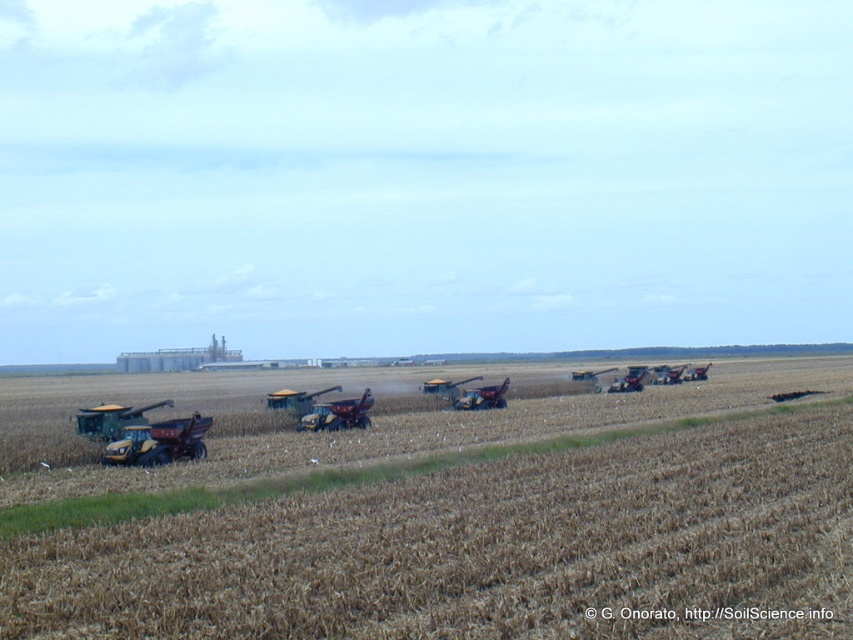
You are standing in the middle of the field looking towards the combine harvesters. There is a point marked at coordinates (x=483, y=397). What object is located at that point?

The metallic red tractor at center is located at the point (x=483, y=397).